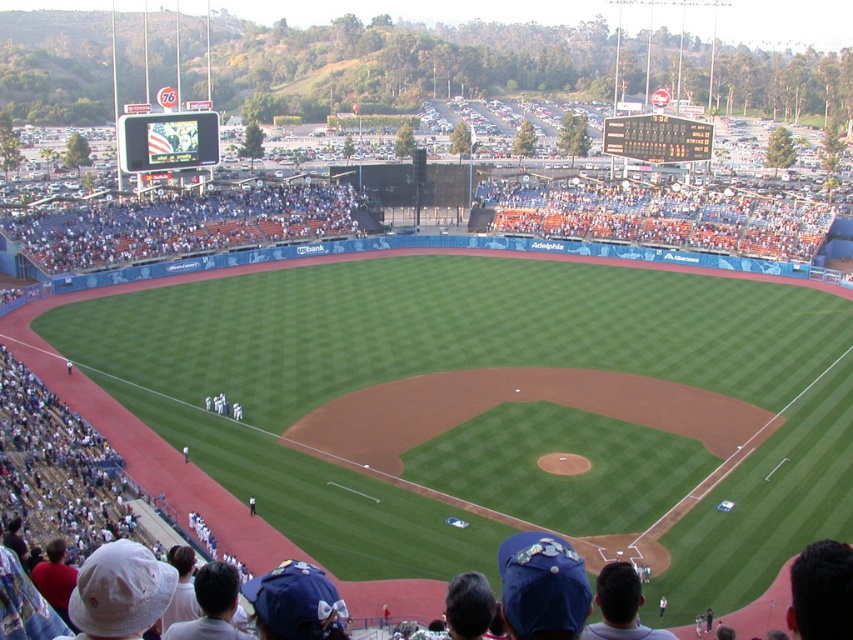
You are a photographer standing at the edge of the field. You want to take a photo that includes both the blue fabric seats at center and the white uniform at center. Which object will appear larger in the photo?

The blue fabric seats at center will appear larger in the photo because they are taller than the white uniform at center.

You are a photographer positioned at the back of the stadium and want to capture both the blue fabric seats at center and the white uniform at center in your photo. Which object will appear closer to you in the final image?

The blue fabric seats at center will appear closer to you in the final image because they are further to the viewer than the white uniform at center.

You are a photographer wanting to capture the entire blue fabric seats at center and white uniform at center in one shot. Given that your camera can only focus on objects within a 10m width, will the combined width of both objects exceed the camera focus limit?

The blue fabric seats at center has a larger width than the white uniform at center. However, since the exact widths are not provided, it is impossible to determine if their combined width exceeds 10 meters. The question cannot be answered with the given information.